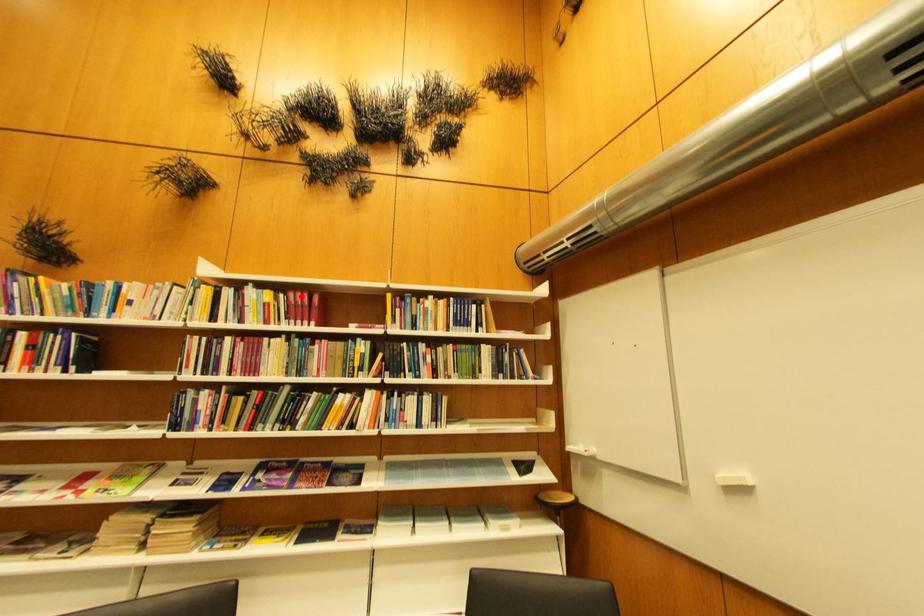
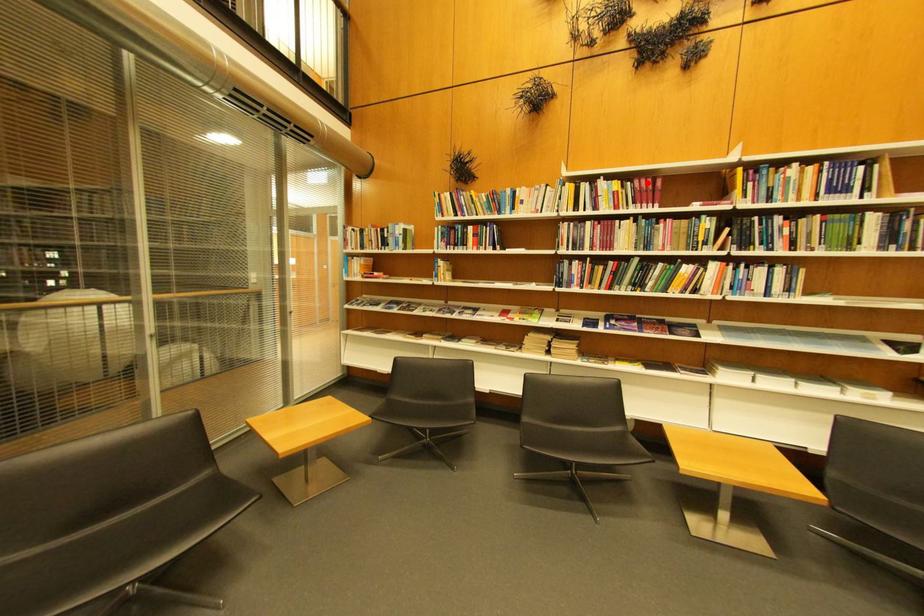
I am providing you with two images of the same scene from different viewpoints. A red point is marked on the first image and another point is marked on the second image. Does the point marked in image1 correspond to the same location as the one in image2?

Yes